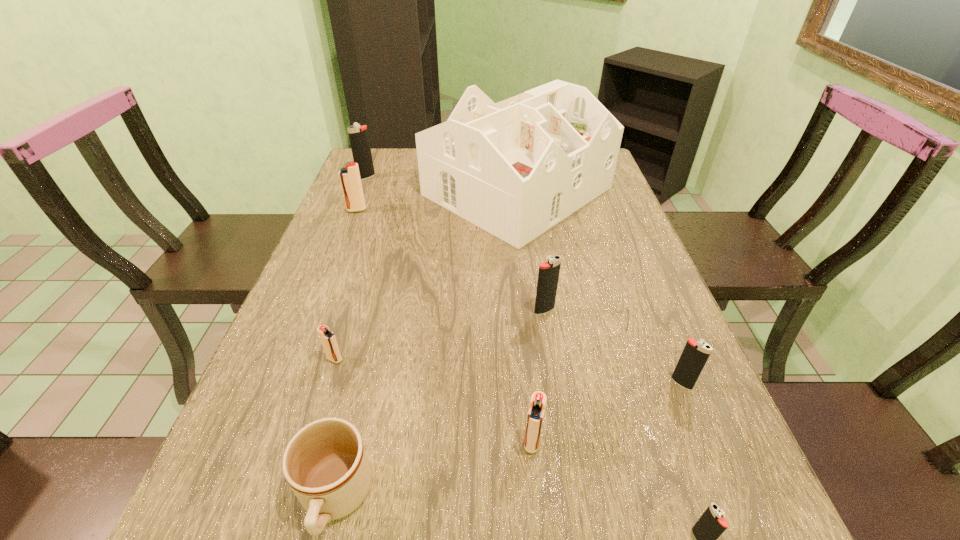
Where is `the tallest object`? the tallest object is located at coordinates (516, 168).

You are a GUI agent. You are given a task and a screenshot of the screen. Output one action in this format:
    pyautogui.click(x=<x>, y=<y>)
    Task: Click on the dollhouse
    This screenshot has width=960, height=540.
    Given the screenshot: What is the action you would take?
    pyautogui.click(x=516, y=168)

Identify the location of the leftmost black igniter. The height and width of the screenshot is (540, 960). (358, 135).

The width and height of the screenshot is (960, 540). Find the location of `the farthest igniter`. the farthest igniter is located at coordinates (358, 135).

Locate an element on the screen. The image size is (960, 540). the sixth nearest igniter is located at coordinates (350, 180).

I want to click on the farthest red igniter, so click(x=350, y=180).

You are a GUI agent. You are given a task and a screenshot of the screen. Output one action in this format:
    pyautogui.click(x=<x>, y=<y>)
    Task: Click on the second black igniter from left to right
    The height and width of the screenshot is (540, 960).
    Given the screenshot: What is the action you would take?
    pyautogui.click(x=548, y=275)

Image resolution: width=960 pixels, height=540 pixels. What are the coordinates of `the second biggest black igniter` in the screenshot? It's located at (548, 275).

This screenshot has width=960, height=540. In order to click on the fourth nearest object in this screenshot , I will do `click(695, 354)`.

Where is `the rightmost black igniter`? The image size is (960, 540). the rightmost black igniter is located at coordinates (695, 354).